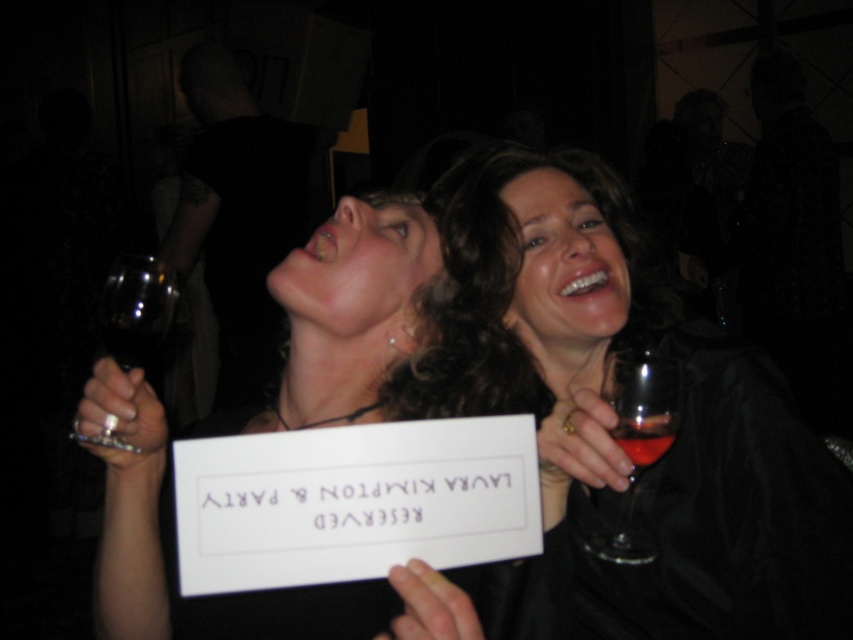
Does transparent glass at upper right appear on the right side of transparent glass at left?

Correct, you'll find transparent glass at upper right to the right of transparent glass at left.

Does transparent glass at upper right appear under transparent glass at left?

Yes.

This screenshot has width=853, height=640. I want to click on transparent glass at upper right, so click(637, 438).

Is point (505, 605) closer to viewer compared to point (165, 332)?

Yes.

Which is in front, point (550, 604) or point (137, 288)?

Positioned in front is point (550, 604).

Identify the location of matte black wine glass at upper right. Image resolution: width=853 pixels, height=640 pixels. (614, 419).

Does matte white sign at center have a greater width compared to transparent glass at upper right?

Indeed, matte white sign at center has a greater width compared to transparent glass at upper right.

Does matte white sign at center appear on the left side of transparent glass at upper right?

Indeed, matte white sign at center is positioned on the left side of transparent glass at upper right.

The image size is (853, 640). Find the location of `matte white sign at center`. matte white sign at center is located at coordinates (347, 314).

Where is `matte white sign at center`? This screenshot has width=853, height=640. matte white sign at center is located at coordinates (347, 314).